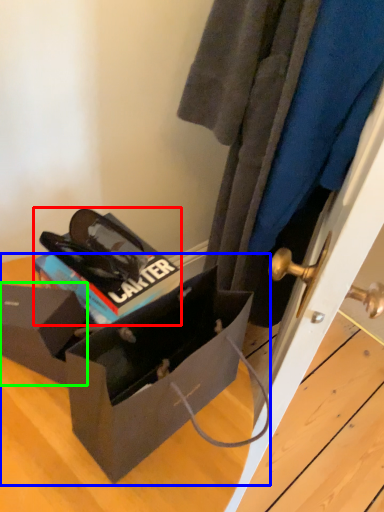
Question: Based on their relative distances, which object is nearer to kit (highlighted by a red box)? Choose from box (highlighted by a blue box) and box (highlighted by a green box).

Choices:
 (A) box
 (B) box

Answer: (B)